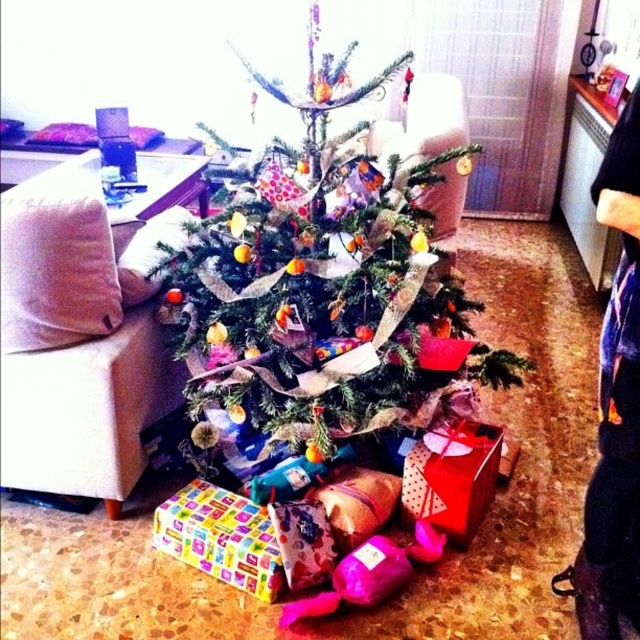
Is multicolored paper wrapped gift at lower center smaller than shiny red gift at lower center?

Yes, multicolored paper wrapped gift at lower center is smaller than shiny red gift at lower center.

Which is behind, point (228, 547) or point (438, 480)?

The point (438, 480) is more distant.

Identify the location of multicolored paper wrapped gift at lower center. (220, 538).

In order to click on multicolored paper wrapped gift at lower center in this screenshot , I will do `click(220, 538)`.

Does dark blue jeans at lower right have a larger size compared to multicolored paper wrapped gift at lower center?

Indeed, dark blue jeans at lower right has a larger size compared to multicolored paper wrapped gift at lower center.

Which is in front, point (634, 136) or point (268, 586)?

Positioned in front is point (634, 136).

Identify the location of dark blue jeans at lower right. Image resolution: width=640 pixels, height=640 pixels. (614, 408).

Can you confirm if green matte christmas tree at center is wider than multicolored paper wrapped gift at lower center?

Correct, the width of green matte christmas tree at center exceeds that of multicolored paper wrapped gift at lower center.

Can you confirm if green matte christmas tree at center is thinner than multicolored paper wrapped gift at lower center?

Incorrect, green matte christmas tree at center's width is not less than multicolored paper wrapped gift at lower center's.

This screenshot has height=640, width=640. What do you see at coordinates (324, 285) in the screenshot? I see `green matte christmas tree at center` at bounding box center [324, 285].

This screenshot has height=640, width=640. Identify the location of green matte christmas tree at center. [324, 285].